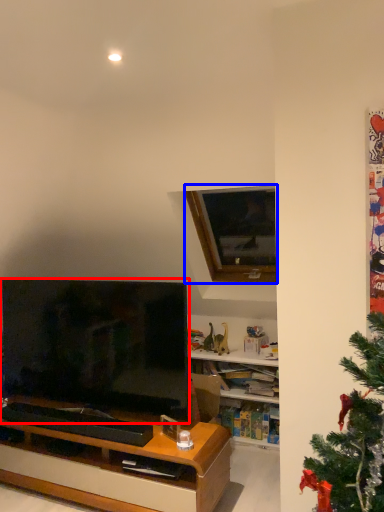
Question: Among these objects, which one is farthest to the camera, television (highlighted by a red box) or window (highlighted by a blue box)?

Choices:
 (A) television
 (B) window

Answer: (B)